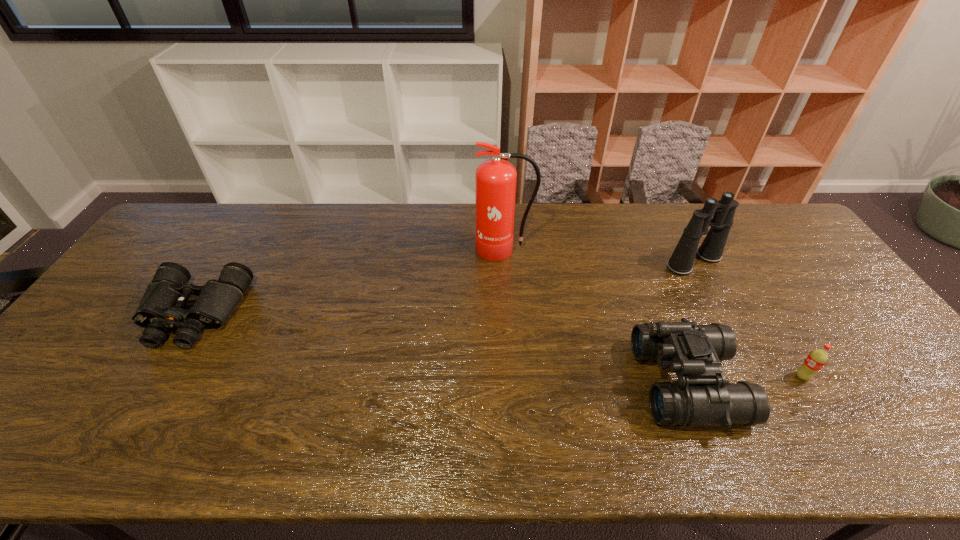
Identify the location of free region that satisfies the following two spatial constraints: 1. on the front side of the rightmost object; 2. through the lenses of the third shortest object. (805, 383).